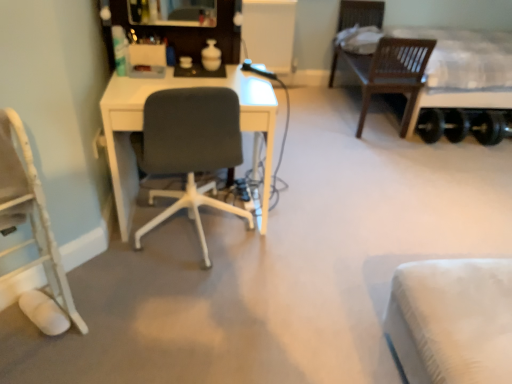
Question: Considering the relative sizes of wooden bed at right and white fabric chair at lower left, positioned as the 1th chair in left-to-right order, in the image provided, is wooden bed at right wider than white fabric chair at lower left, positioned as the 1th chair in left-to-right order,?

Choices:
 (A) no
 (B) yes

Answer: (B)

Question: Is wooden bed at right thinner than white fabric chair at lower left, positioned as the 1th chair in left-to-right order?

Choices:
 (A) yes
 (B) no

Answer: (B)

Question: From the image's perspective, is wooden bed at right over white fabric chair at lower left, positioned as the 1th chair in left-to-right order?

Choices:
 (A) yes
 (B) no

Answer: (A)

Question: Is wooden bed at right behind white fabric chair at lower left, the 2th chair when ordered from right to left?

Choices:
 (A) yes
 (B) no

Answer: (A)

Question: Does wooden bed at right touch white fabric chair at lower left, the 2th chair when ordered from right to left?

Choices:
 (A) yes
 (B) no

Answer: (B)

Question: From a real-world perspective, is white fabric chair at lower left, positioned as the 1th chair in left-to-right order, physically located above or below matte gray chair at center, acting as the second chair starting from the left?

Choices:
 (A) below
 (B) above

Answer: (B)

Question: Considering the positions of point (29, 165) and point (151, 170), is point (29, 165) closer or farther from the camera than point (151, 170)?

Choices:
 (A) closer
 (B) farther

Answer: (A)

Question: From the image's perspective, is white fabric chair at lower left, positioned as the 1th chair in left-to-right order, positioned above or below matte gray chair at center, which is the 1th chair from right to left?

Choices:
 (A) below
 (B) above

Answer: (A)

Question: Looking at the image, does white fabric chair at lower left, the 2th chair when ordered from right to left, seem bigger or smaller compared to matte gray chair at center, acting as the second chair starting from the left?

Choices:
 (A) small
 (B) big

Answer: (A)

Question: Is matte gray chair at center, which is the 1th chair from right to left, in front of or behind white fabric chair at lower left, the 2th chair when ordered from right to left, in the image?

Choices:
 (A) front
 (B) behind

Answer: (B)

Question: Based on their positions, is matte gray chair at center, acting as the second chair starting from the left, located to the left or right of white fabric chair at lower left, positioned as the 1th chair in left-to-right order?

Choices:
 (A) right
 (B) left

Answer: (A)

Question: Is matte gray chair at center, acting as the second chair starting from the left, wider or thinner than white fabric chair at lower left, positioned as the 1th chair in left-to-right order?

Choices:
 (A) thin
 (B) wide

Answer: (B)

Question: From the image's perspective, is matte gray chair at center, acting as the second chair starting from the left, positioned above or below white fabric chair at lower left, the 2th chair when ordered from right to left?

Choices:
 (A) above
 (B) below

Answer: (A)

Question: Considering the positions of point (151, 162) and point (490, 38), is point (151, 162) closer or farther from the camera than point (490, 38)?

Choices:
 (A) farther
 (B) closer

Answer: (B)

Question: Is matte gray chair at center, acting as the second chair starting from the left, inside the boundaries of wooden bed at right, or outside?

Choices:
 (A) inside
 (B) outside

Answer: (B)